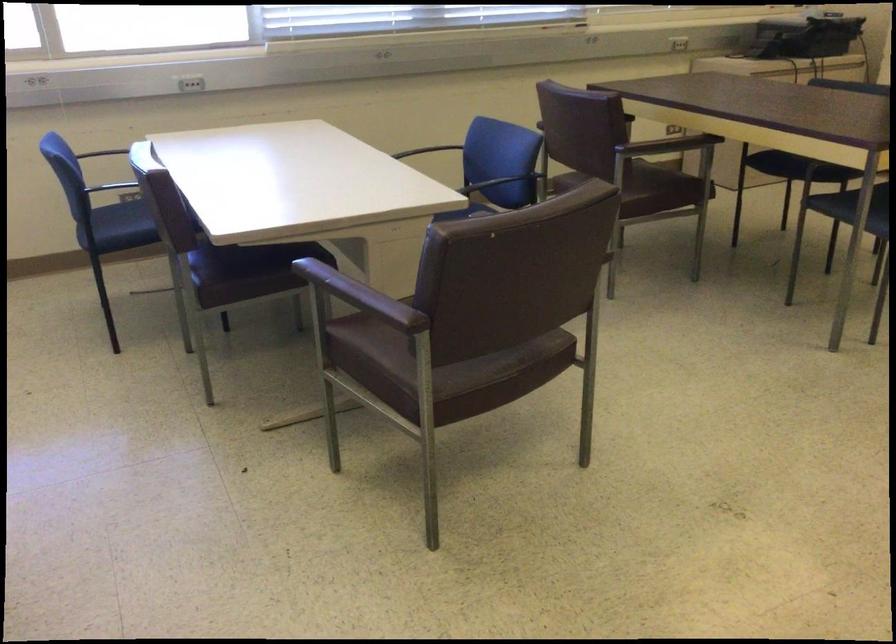
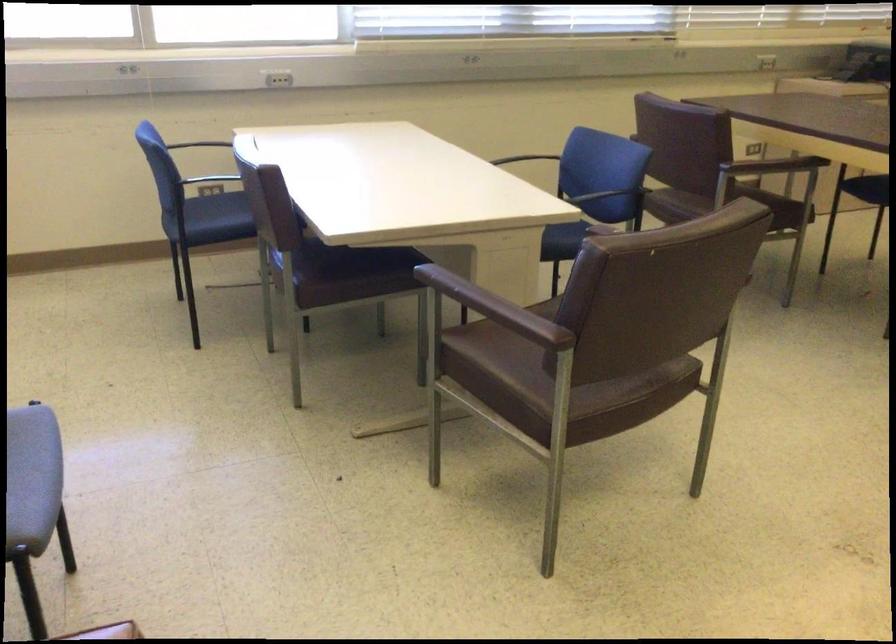
The point at (133, 214) is marked in the first image. Where is the corresponding point in the second image?

(220, 207)